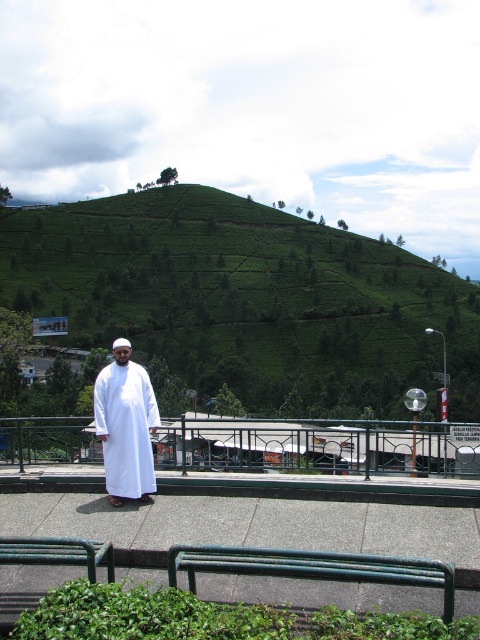
Question: Does green leafy hillside at upper center appear over white cotton robe at center?

Choices:
 (A) no
 (B) yes

Answer: (B)

Question: Which point is closer to the camera?

Choices:
 (A) (12, 209)
 (B) (128, 436)

Answer: (B)

Question: Can you confirm if green leafy hillside at upper center is wider than white cotton robe at center?

Choices:
 (A) yes
 (B) no

Answer: (A)

Question: Which of the following is the farthest from the observer?

Choices:
 (A) (117, 358)
 (B) (196, 320)

Answer: (B)

Question: Is green leafy hillside at upper center further to camera compared to white cotton robe at center?

Choices:
 (A) no
 (B) yes

Answer: (B)